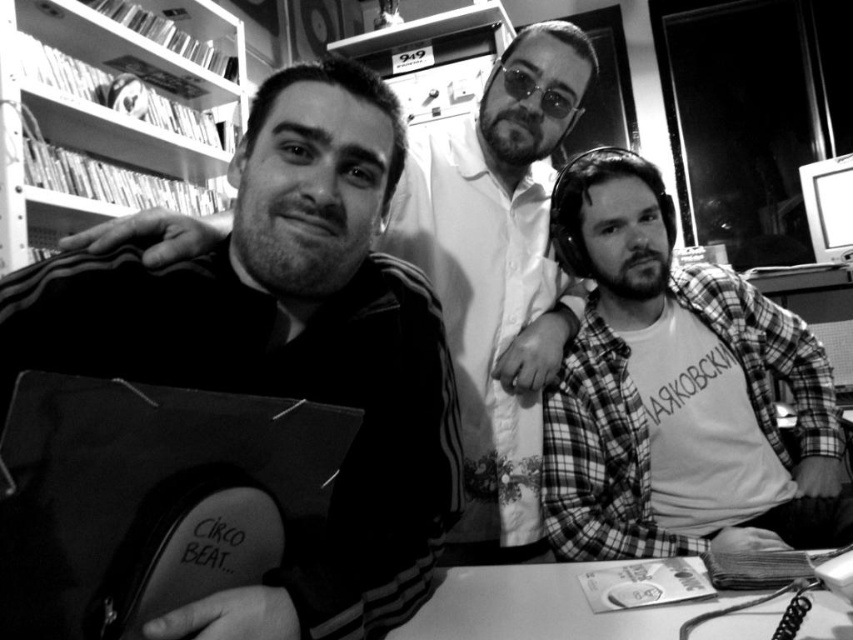
Based on the provided scene description, what object is located at the coordinates point (107,120)?

The metallic shelves at upper left are located at point (107,120).

From the picture: You are a photographer setting up for a photoshoot. You need to place a 20 inch wide camera stand between the smooth black jacket at left and the smooth white table at lower center. Is there enough space between them for the camera stand?

The smooth black jacket at left and smooth white table at lower center are 19.83 inches apart from each other, so there is not enough space to place a 20 inch wide camera stand between them.

You are a photographer who wants to capture a closeup of the smooth black jacket at left without the metallic shelves at upper left appearing in the frame. Is it possible to do so by moving the camera slightly to the right?

The smooth black jacket at left is thinner than the metallic shelves at upper left, so moving the camera slightly to the right might allow you to focus on the jacket while excluding the shelves from the frame.